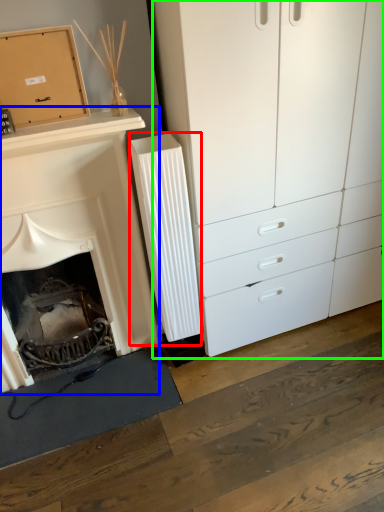
Question: Which object is the closest to the radiator (highlighted by a red box)? Choose among these: fireplace (highlighted by a blue box) or chest of drawers (highlighted by a green box).

Choices:
 (A) fireplace
 (B) chest of drawers

Answer: (A)